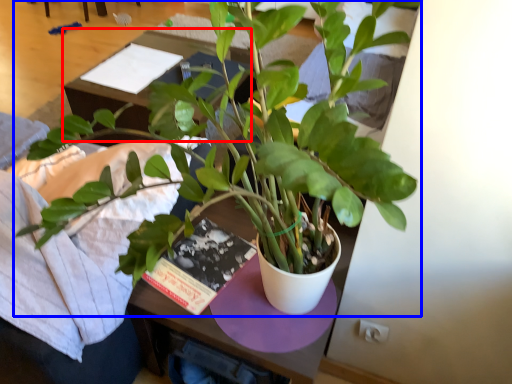
Question: Which point is closer to the camera, table (highlighted by a red box) or houseplant (highlighted by a blue box)?

Choices:
 (A) table
 (B) houseplant

Answer: (B)